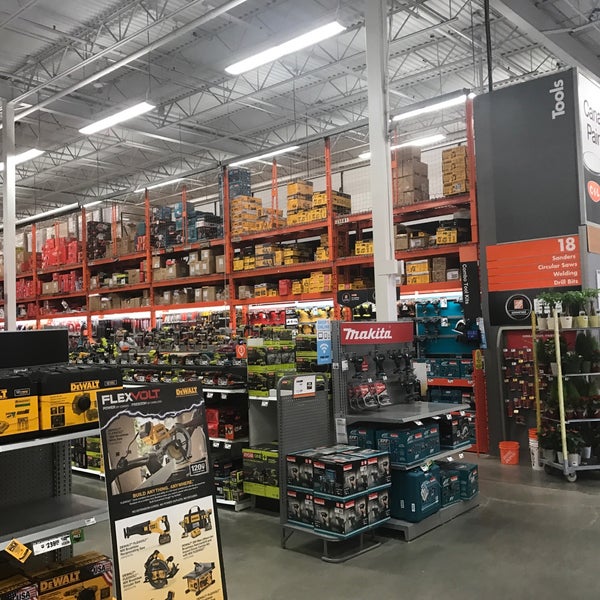
Where is `rack with plants on it`? The width and height of the screenshot is (600, 600). rack with plants on it is located at coordinates (587, 464), (581, 410), (576, 367), (578, 322).